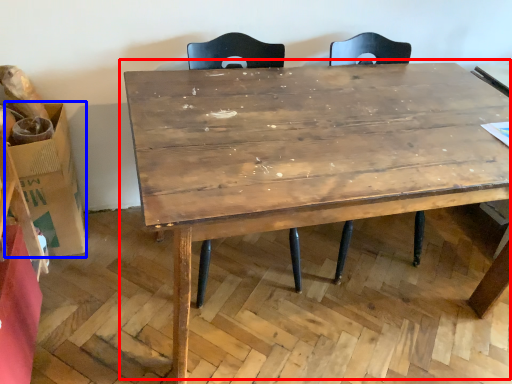
Question: Which object is closer to the camera taking this photo, table (highlighted by a red box) or cardboard box (highlighted by a blue box)?

Choices:
 (A) table
 (B) cardboard box

Answer: (A)